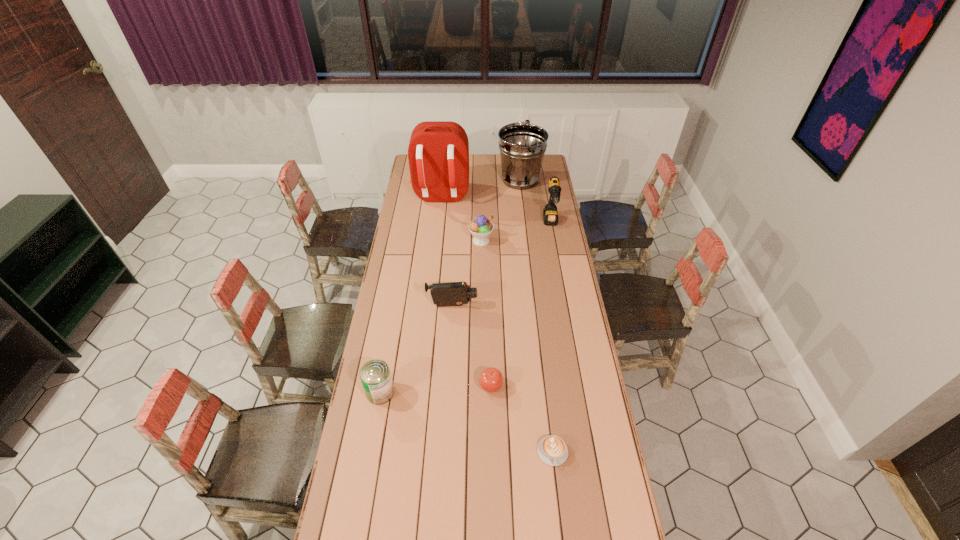
Image resolution: width=960 pixels, height=540 pixels. In order to click on free space that satisfies the following two spatial constraints: 1. on the back side of the can; 2. on the right side of the icecream in this screenshot , I will do `click(408, 240)`.